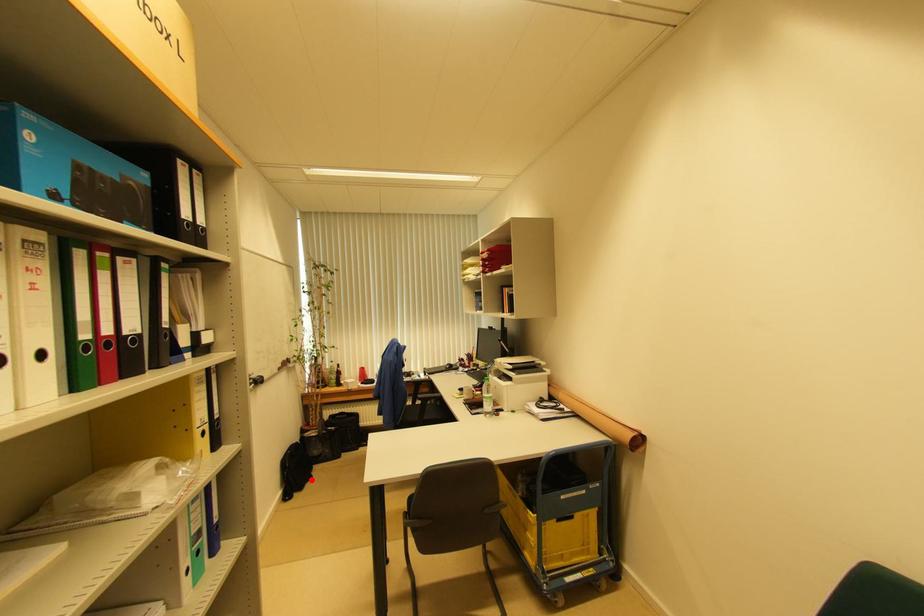
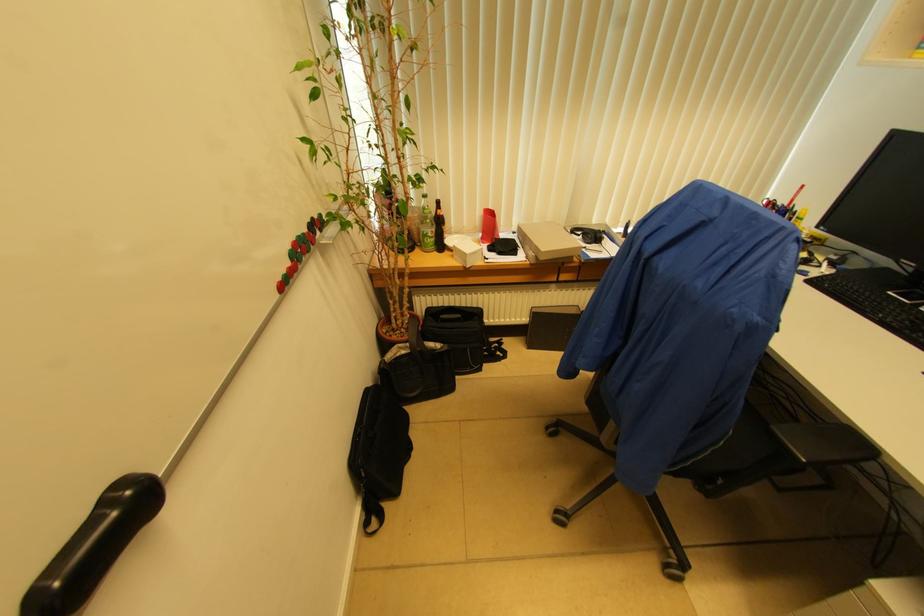
Question: I am providing you with two images of the same scene from different viewpoints. A red point is shown in image1. For the corresponding object point in image2, is it positioned nearer or farther from the camera?

Choices:
 (A) Nearer
 (B) Farther

Answer: (A)